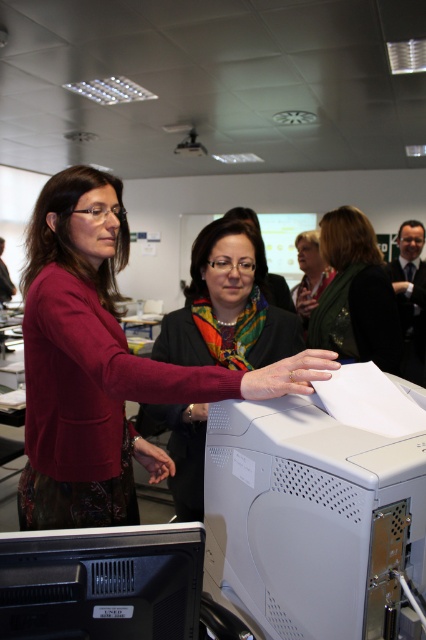
You are standing in the conference room and need to determine the relative positions of two points marked in the scene. Which point, point 1 at coordinates (296,465) or point 2 at coordinates (373,259), is closer to you?

Point 1 at coordinates (296,465) is closer to the viewer than point 2 at coordinates (373,259).

You are standing in the conference room and need to locate both the black plastic computer monitor at lower left and the green textured scarf at center. Which object is positioned lower in the scene?

The black plastic computer monitor at lower left is positioned below the green textured scarf at center, so it is the lower object.

You are a delivery person who needs to place a package between the black plastic computer monitor at lower left and the green textured scarf at center. The package requires 1.5 meters of space. Can you fit it there?

The distance between the black plastic computer monitor at lower left and the green textured scarf at center is 1.49 meters, which is slightly less than the required 1.5 meters. Therefore, the package cannot be placed there.